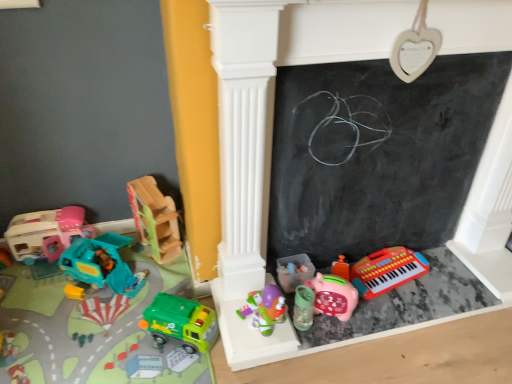
Locate an element on the screen. The image size is (512, 384). vacant area that lies in front of teal plastic truck at left, which appears as the second toy when viewed from the left is located at coordinates (73, 326).